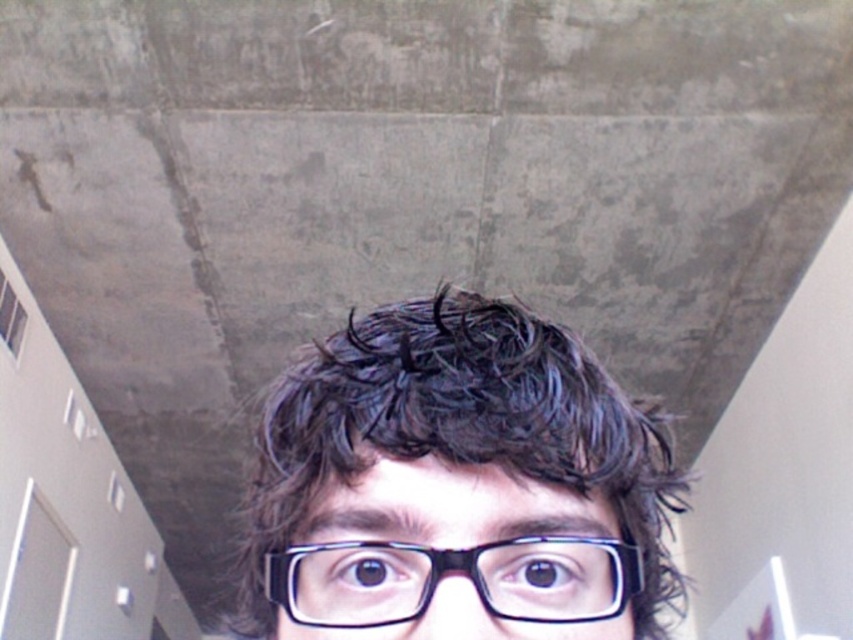
Question: Which point is closer to the camera taking this photo?

Choices:
 (A) (409, 572)
 (B) (473, 364)

Answer: (A)

Question: Is black glossy glasses at center to the left of black plastic glasses at center from the viewer's perspective?

Choices:
 (A) yes
 (B) no

Answer: (A)

Question: Among these points, which one is nearest to the camera?

Choices:
 (A) (595, 582)
 (B) (581, 472)

Answer: (A)

Question: Can you confirm if black glossy glasses at center is positioned to the left of black plastic glasses at center?

Choices:
 (A) no
 (B) yes

Answer: (B)

Question: Can you confirm if black glossy glasses at center is positioned below black plastic glasses at center?

Choices:
 (A) yes
 (B) no

Answer: (A)